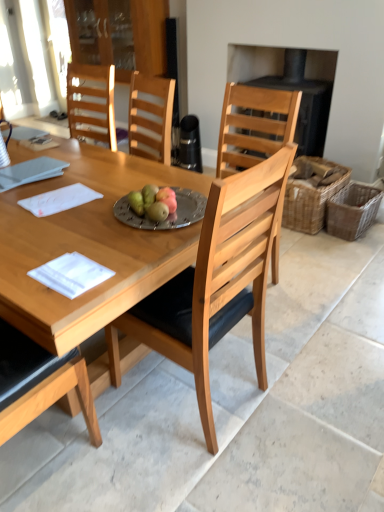
This screenshot has height=512, width=384. Identify the location of free space in front of white paper at center, which is the 2th notepad from top to bottom. (57, 227).